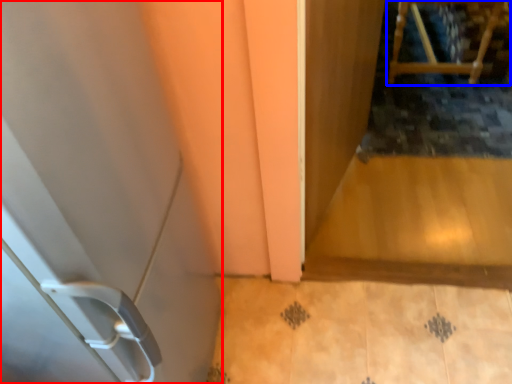
Question: Which point is further to the camera, door (highlighted by a red box) or furniture (highlighted by a blue box)?

Choices:
 (A) door
 (B) furniture

Answer: (B)